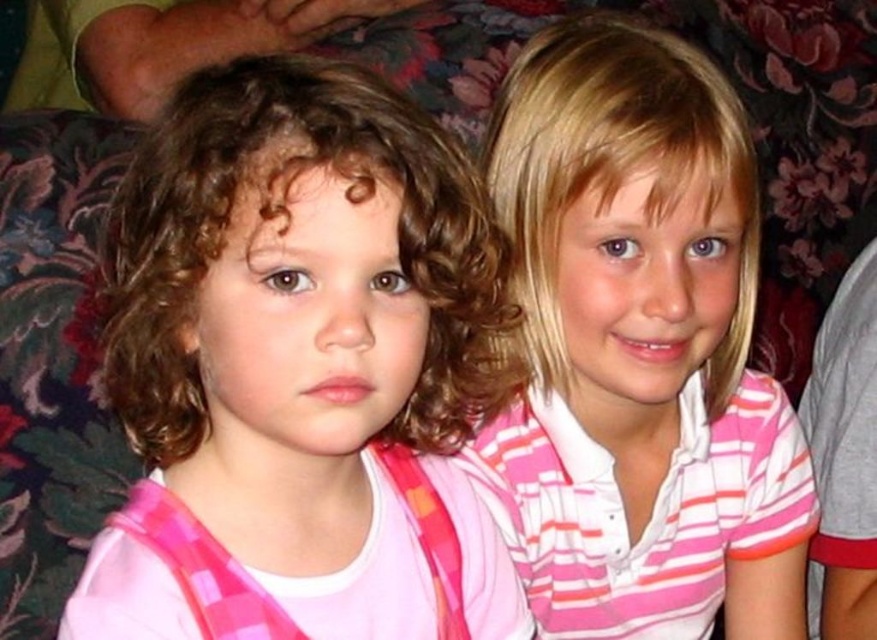
Is the position of pink plaid shirt at left more distant than that of pink striped shirt at upper right?

No, pink plaid shirt at left is in front of pink striped shirt at upper right.

Does pink plaid shirt at left come in front of pink striped shirt at upper right?

Yes, pink plaid shirt at left is in front of pink striped shirt at upper right.

Who is more distant from viewer, (195, 465) or (667, 209)?

The point (667, 209) is more distant.

Find the location of a particular element. Image resolution: width=877 pixels, height=640 pixels. pink plaid shirt at left is located at coordinates (301, 371).